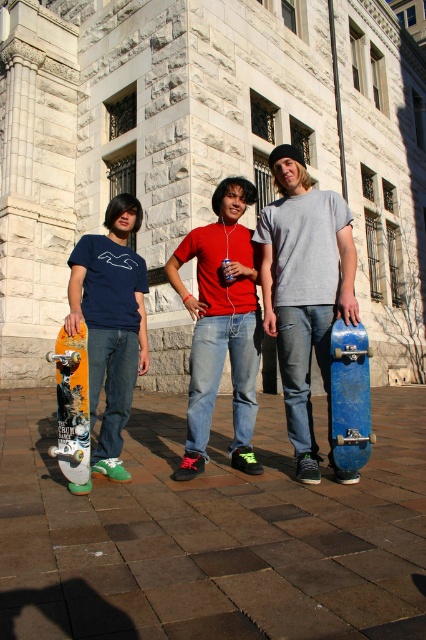
You are standing at the point marked by the coordinates point (x=212, y=532) in the image. What is the material of the ground beneath your feet?

The point (x=212, y=532) marks brown brick pavement at center, so the material of the ground beneath your feet is brown brick pavement.

You are planning to place the blue matte skateboard at right on the brown brick pavement at center. Based on their sizes, will the skateboard fit entirely on the pavement?

The brown brick pavement at center occupies less space than the blue matte skateboard at right, so the skateboard will not fit entirely on the pavement.

You are trying to place the blue matte skateboard at right on the brown brick pavement at center. Based on their widths, will it fit?

The brown brick pavement at center might be wider than blue matte skateboard at right, so it is possible that the skateboard will fit on the pavement.